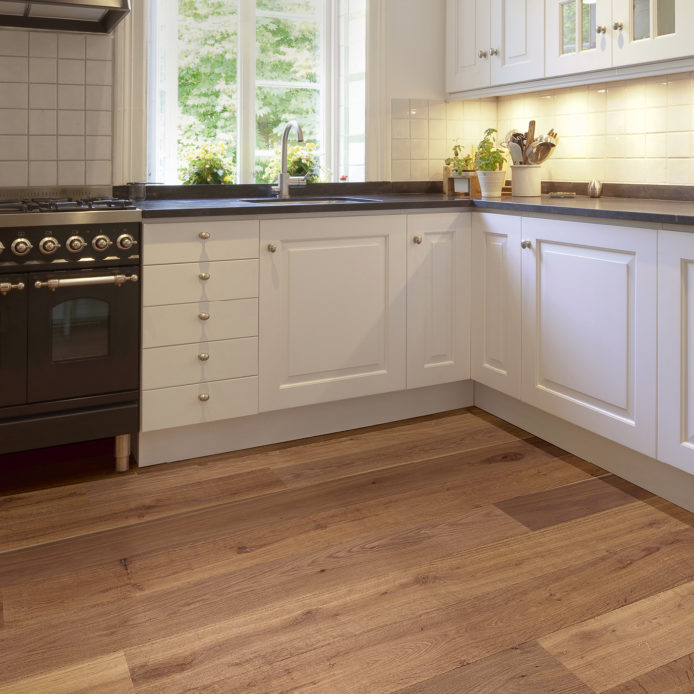
At what (x,y) coordinates should I click in order to perform the action: click on tiled area. Please return your answer as a coordinate pair (x, y). The image size is (694, 694). Looking at the image, I should click on (42, 118), (636, 128), (432, 133).